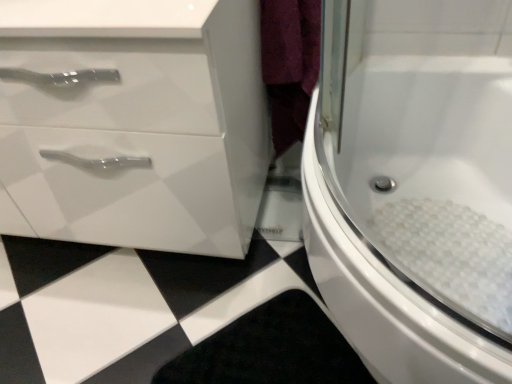
Question: Is white glossy bathtub at center right located outside white glossy cabinet at left?

Choices:
 (A) yes
 (B) no

Answer: (A)

Question: From a real-world perspective, is white glossy bathtub at center right under white glossy cabinet at left?

Choices:
 (A) yes
 (B) no

Answer: (A)

Question: From the image's perspective, is white glossy bathtub at center right below white glossy cabinet at left?

Choices:
 (A) yes
 (B) no

Answer: (A)

Question: Is white glossy bathtub at center right looking in the opposite direction of white glossy cabinet at left?

Choices:
 (A) yes
 (B) no

Answer: (B)

Question: Is white glossy bathtub at center right smaller than white glossy cabinet at left?

Choices:
 (A) yes
 (B) no

Answer: (A)

Question: Considering the relative sizes of white glossy bathtub at center right and white glossy cabinet at left in the image provided, is white glossy bathtub at center right shorter than white glossy cabinet at left?

Choices:
 (A) yes
 (B) no

Answer: (A)

Question: Can you confirm if white glossy cabinet at left is taller than white glossy bathtub at center right?

Choices:
 (A) yes
 (B) no

Answer: (A)

Question: Is white glossy cabinet at left looking in the opposite direction of white glossy bathtub at center right?

Choices:
 (A) yes
 (B) no

Answer: (B)

Question: From the image's perspective, is white glossy cabinet at left above white glossy bathtub at center right?

Choices:
 (A) yes
 (B) no

Answer: (A)

Question: Is white glossy cabinet at left at the right side of white glossy bathtub at center right?

Choices:
 (A) yes
 (B) no

Answer: (B)

Question: Can you confirm if white glossy cabinet at left is positioned to the left of white glossy bathtub at center right?

Choices:
 (A) yes
 (B) no

Answer: (A)

Question: Can you confirm if white glossy cabinet at left is thinner than white glossy bathtub at center right?

Choices:
 (A) no
 (B) yes

Answer: (B)

Question: Looking at the image, does white glossy cabinet at left seem bigger or smaller compared to white glossy bathtub at center right?

Choices:
 (A) small
 (B) big

Answer: (B)